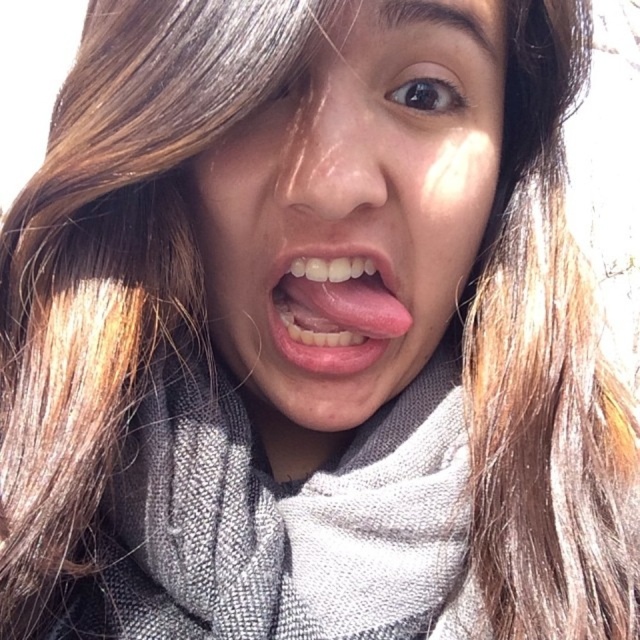
Question: Which object is farther from the camera taking this photo?

Choices:
 (A) pink matte tongue at center
 (B) gray knitted scarf at center

Answer: (A)

Question: Does matte gray scarf at center lie behind gray knitted scarf at center?

Choices:
 (A) yes
 (B) no

Answer: (B)

Question: Which point is closer to the camera?

Choices:
 (A) (301, 237)
 (B) (314, 362)
 (C) (218, 605)

Answer: (C)

Question: Is matte gray scarf at center to the left of gray knitted scarf at center from the viewer's perspective?

Choices:
 (A) yes
 (B) no

Answer: (B)

Question: Does gray knitted scarf at center have a smaller size compared to pink matte tongue at center?

Choices:
 (A) yes
 (B) no

Answer: (B)

Question: Which point is farther to the camera?

Choices:
 (A) pink matte tongue at center
 (B) matte gray scarf at center
 (C) gray knitted scarf at center

Answer: (A)